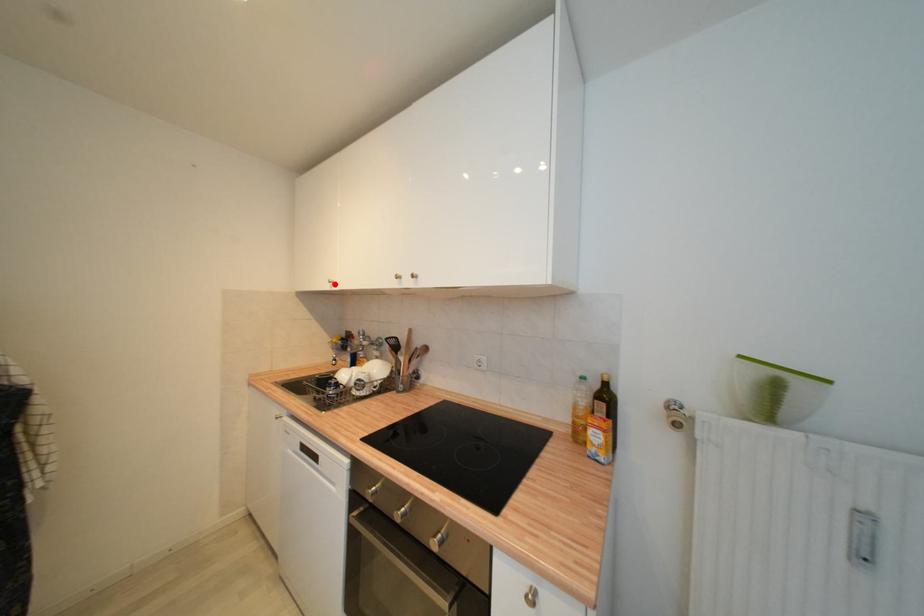
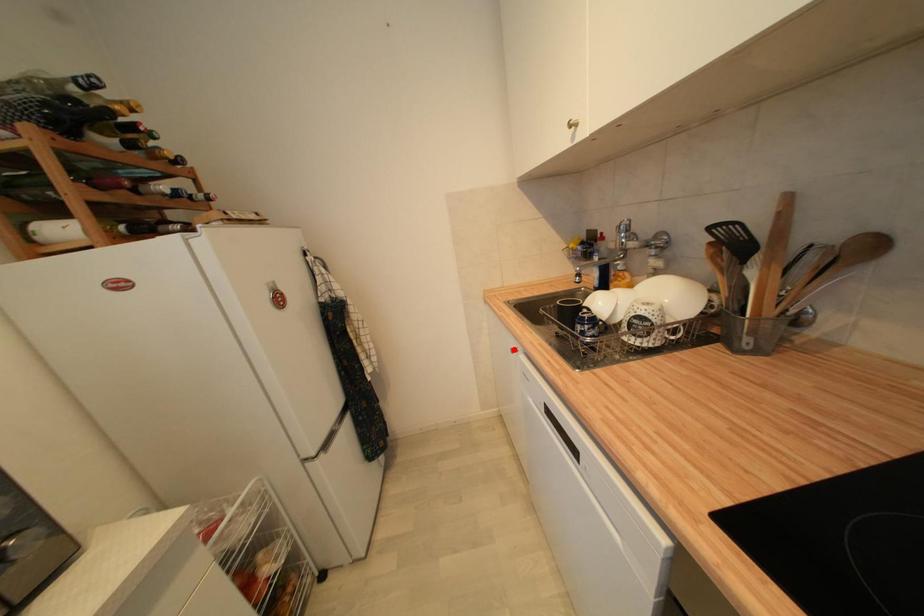
I am providing you with two images of the same scene from different viewpoints. A red point is marked on the first image and another point is marked on the second image. Does the point marked in image1 correspond to the same location as the one in image2?

No